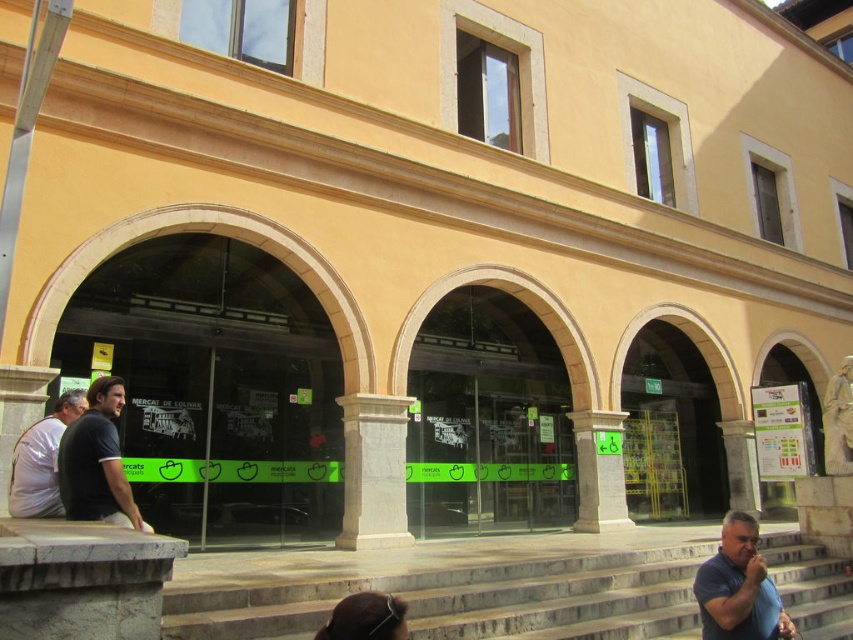
Question: Can you confirm if smooth stone stairs at lower center is thinner than gray stone pillar at center?

Choices:
 (A) yes
 (B) no

Answer: (B)

Question: Among these objects, which one is farthest from the camera?

Choices:
 (A) gray stone pillar at center
 (B) white matte shirt at left
 (C) stone column at center
 (D) dark blue shirt at lower right

Answer: (A)

Question: Which of the following is the closest to the observer?

Choices:
 (A) (57, 464)
 (B) (288, 630)
 (C) (347, 445)
 (D) (608, 476)

Answer: (A)

Question: Which object is farther from the camera taking this photo?

Choices:
 (A) gray stone pillar at center
 (B) gray stone column at center

Answer: (A)

Question: Is stone column at center below white matte shirt at left?

Choices:
 (A) no
 (B) yes

Answer: (B)

Question: Is smooth stone stairs at lower center wider than stone column at center?

Choices:
 (A) no
 (B) yes

Answer: (B)